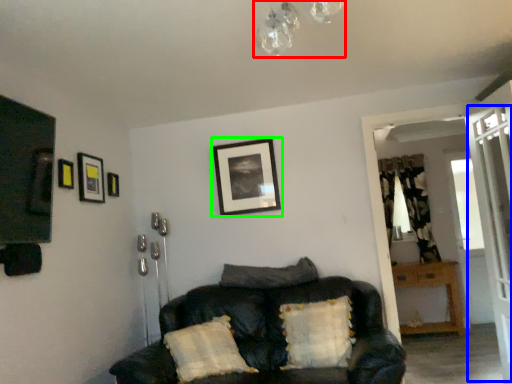
Question: Which object is positioned closest to light fixture (highlighted by a red box)? Select from screen door (highlighted by a blue box) and picture frame (highlighted by a green box).

Choices:
 (A) screen door
 (B) picture frame

Answer: (B)